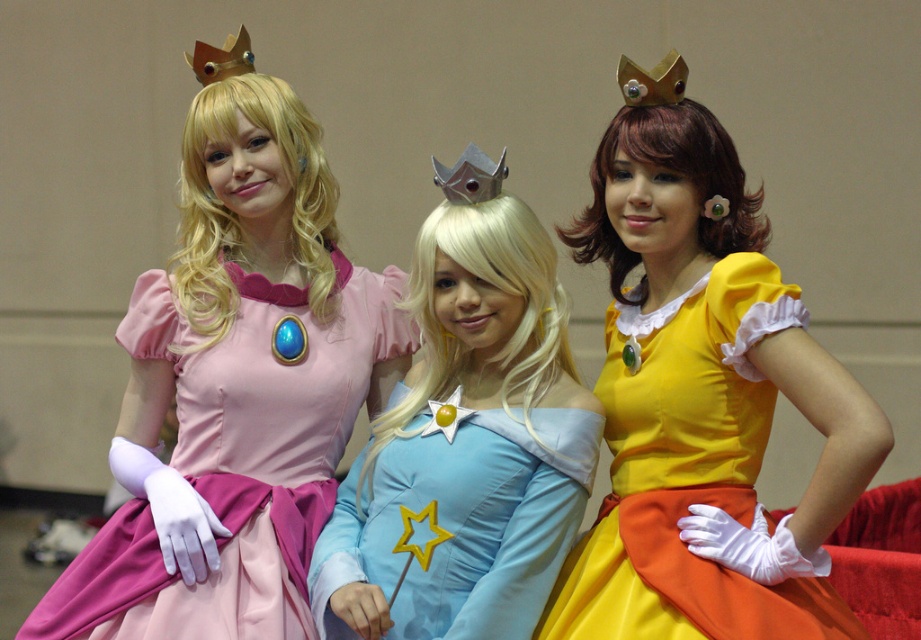
Does matte yellow dress at center have a smaller size compared to matte pink fabric dress at left?

Actually, matte yellow dress at center might be larger than matte pink fabric dress at left.

Which is in front, point (556, 627) or point (367, 312)?

Point (556, 627)

Find the location of a particular element. The height and width of the screenshot is (640, 921). matte yellow dress at center is located at coordinates (701, 394).

I want to click on matte yellow dress at center, so click(x=701, y=394).

Is light blue satin dress at center shorter than matte pink fabric dress at left?

Incorrect, light blue satin dress at center's height does not fall short of matte pink fabric dress at left's.

Describe the element at coordinates (469, 442) in the screenshot. I see `light blue satin dress at center` at that location.

The image size is (921, 640). What do you see at coordinates (469, 442) in the screenshot? I see `light blue satin dress at center` at bounding box center [469, 442].

The image size is (921, 640). Identify the location of light blue satin dress at center. (469, 442).

Between matte yellow dress at center and light blue satin dress at center, which one appears on the left side from the viewer's perspective?

light blue satin dress at center

Between matte yellow dress at center and light blue satin dress at center, which one appears on the right side from the viewer's perspective?

From the viewer's perspective, matte yellow dress at center appears more on the right side.

The image size is (921, 640). Identify the location of matte yellow dress at center. (701, 394).